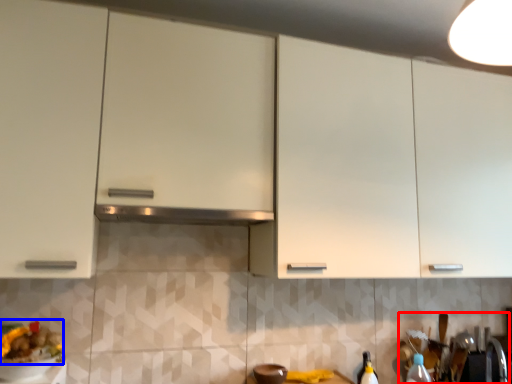
Question: Which object is closer to the camera taking this photo, sink (highlighted by a red box) or food (highlighted by a blue box)?

Choices:
 (A) sink
 (B) food

Answer: (B)